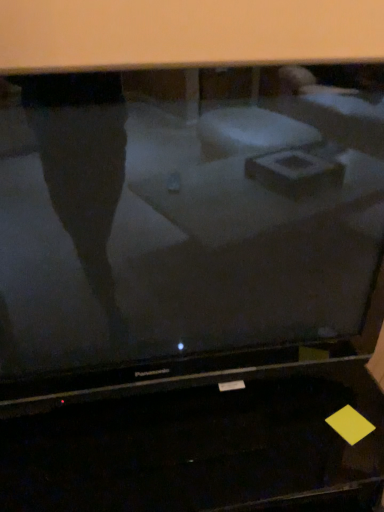
Where is `vacant region under matte black television at center (from a real-world perspective)`? vacant region under matte black television at center (from a real-world perspective) is located at coordinates (196, 422).